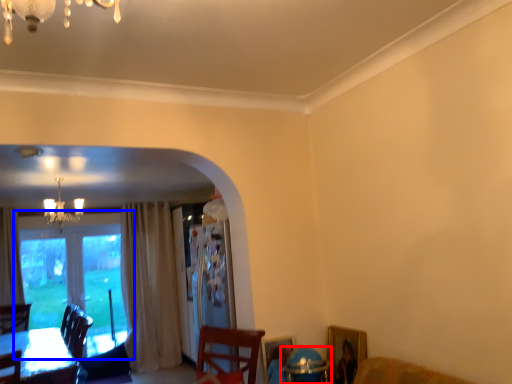
Question: Which of the following is the closest to the observer, round table (highlighted by a red box) or window (highlighted by a blue box)?

Choices:
 (A) round table
 (B) window

Answer: (A)